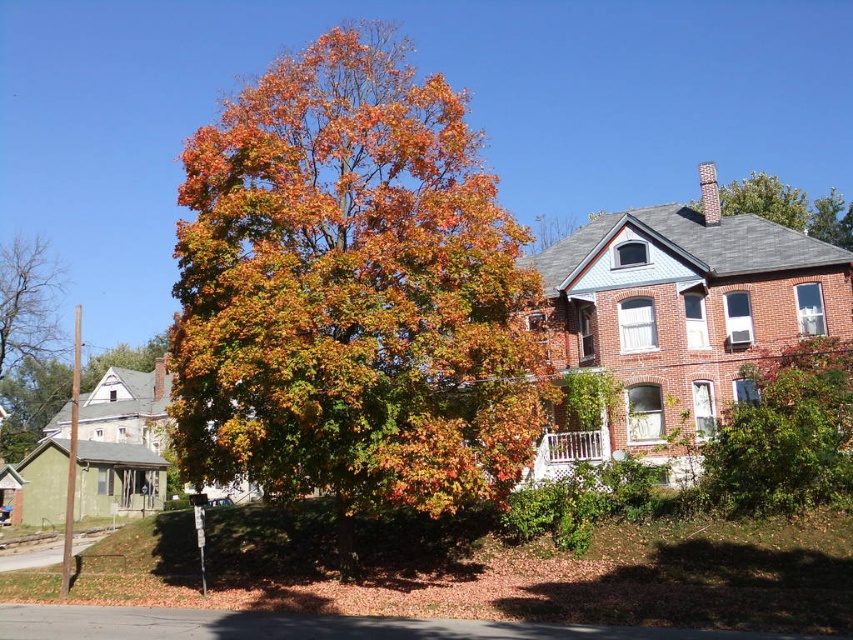
You are planning to take a photo of the multicolored foliage at center and the bare branches at left. Which object should you focus on first if you want to capture both in a single frame without moving the camera?

You should focus on the multicolored foliage at center first because it is larger in size than the bare branches at left, making it the more prominent subject to include in the frame.

You are a painter wanting to capture the autumn scene. You notice the multicolored foliage at center and the bare branches at left. Which object should you paint first to ensure proper layering in your artwork?

You should paint the bare branches at left first because the multicolored foliage at center is in front of them, so the branches need to be layered behind the foliage.